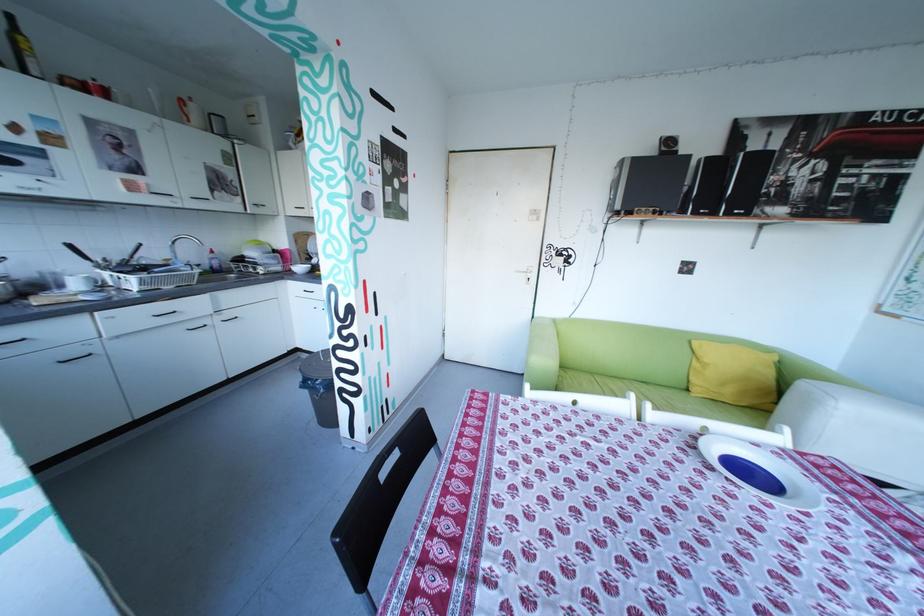
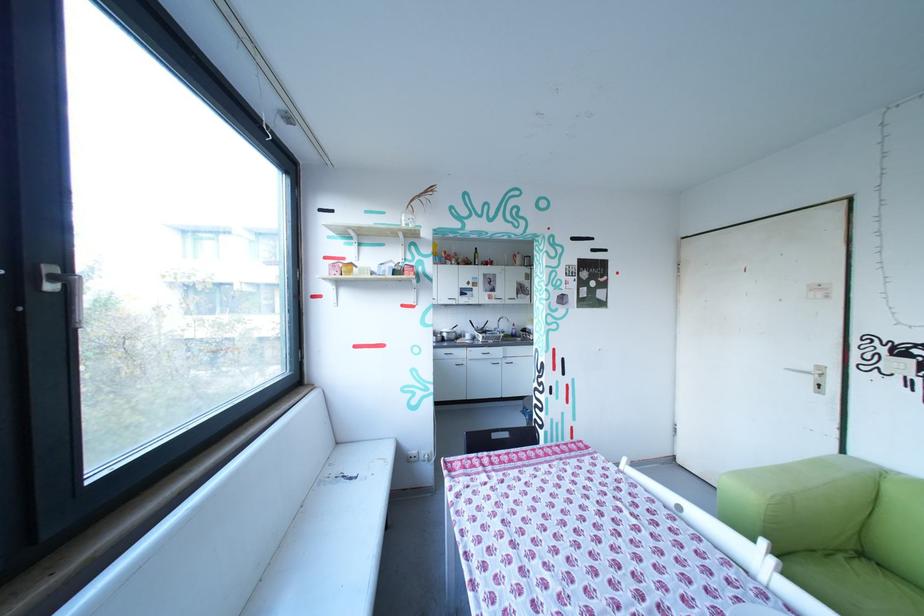
Where in the second image is the point corresponding to point (395, 475) from the first image?

(507, 436)